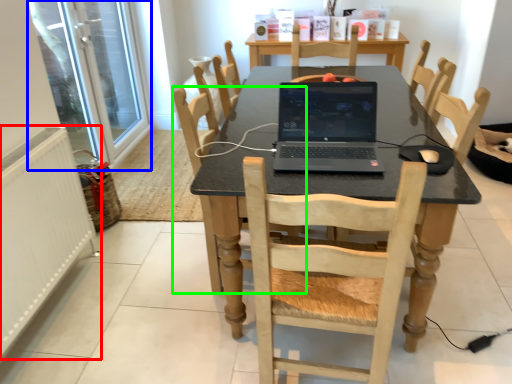
Question: Considering the real-world distances, which object is farthest from radiator (highlighted by a red box)? screen door (highlighted by a blue box) or chair (highlighted by a green box)?

Choices:
 (A) screen door
 (B) chair

Answer: (A)